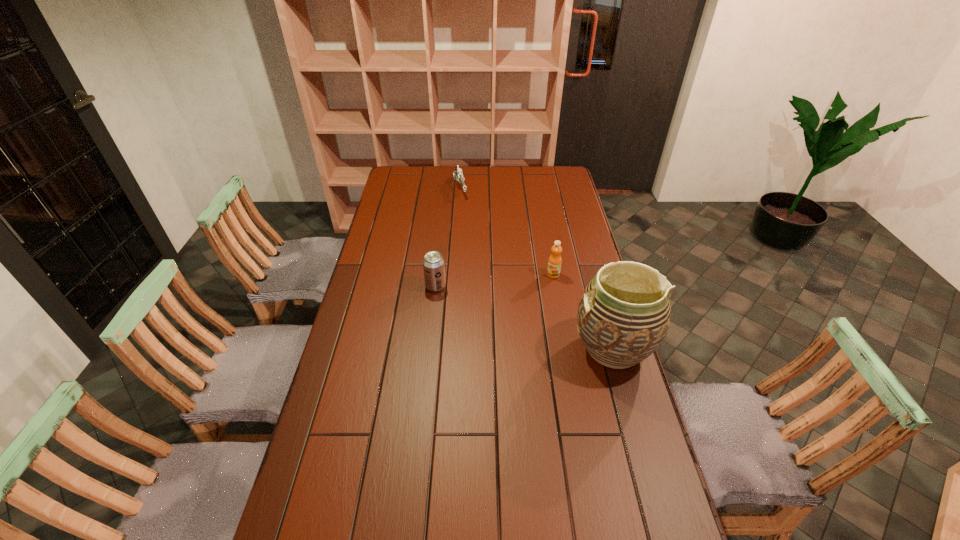
What are the coordinates of `vacant space located on the front label of the third nearest object` in the screenshot? It's located at coord(532,294).

Image resolution: width=960 pixels, height=540 pixels. I want to click on vacant region located 0.250m aimed along the barrel of the gun, so click(471, 231).

Image resolution: width=960 pixels, height=540 pixels. I want to click on vacant space located aimed along the barrel of the gun, so click(463, 206).

You are a GUI agent. You are given a task and a screenshot of the screen. Output one action in this format:
    pyautogui.click(x=<x>, y=<y>)
    Task: Click on the vacant space located aimed along the barrel of the gun
    
    Given the screenshot: What is the action you would take?
    pyautogui.click(x=473, y=236)

Where is `object that is positioned at the far edge`? object that is positioned at the far edge is located at coordinates (457, 175).

You are a GUI agent. You are given a task and a screenshot of the screen. Output one action in this format:
    pyautogui.click(x=<x>, y=<y>)
    Task: Click on the pottery that is at the right edge
    Image resolution: width=960 pixels, height=540 pixels.
    Given the screenshot: What is the action you would take?
    (x=623, y=316)

Find the location of a particular element. orange juice situated at the right edge is located at coordinates (554, 263).

I want to click on vacant region at the far edge of the desktop, so click(x=526, y=167).

The height and width of the screenshot is (540, 960). Find the location of `blank area at the left edge`. blank area at the left edge is located at coordinates (362, 305).

In the image, there is a desktop. Identify the location of vacant area at the right edge. (590, 446).